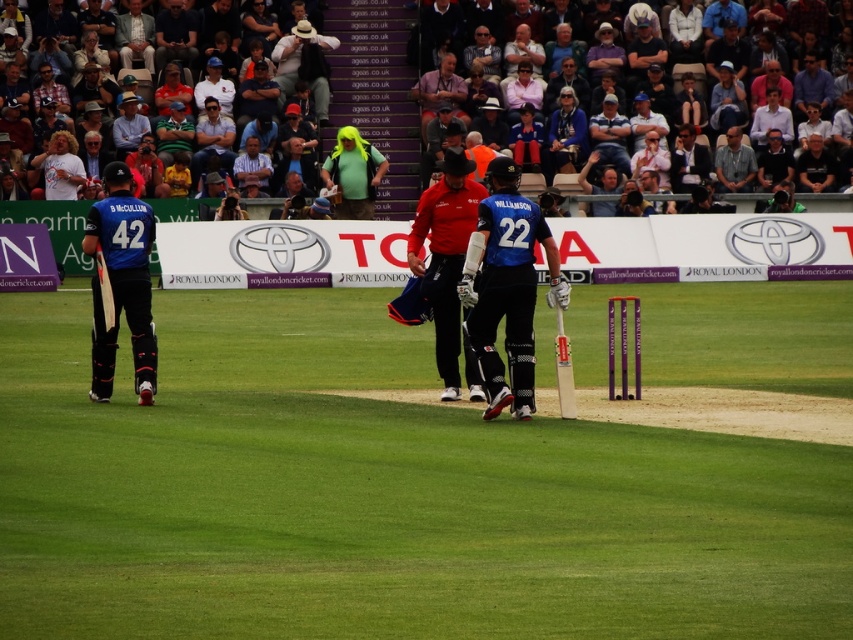
Between red matte bat at center and light brown leather jacket at upper center, which one has less height?

light brown leather jacket at upper center is shorter.

Which is in front, point (463, 244) or point (474, 61)?

Point (463, 244)

At what (x,y) coordinates should I click in order to perform the action: click on red matte bat at center. Please return your answer as a coordinate pair (x, y). The width and height of the screenshot is (853, 640). Looking at the image, I should click on (445, 253).

From the picture: Does light blue shirt at upper center have a greater width compared to gray fabric jacket at upper right?

Incorrect, light blue shirt at upper center's width does not surpass gray fabric jacket at upper right's.

Is light blue shirt at upper center thinner than gray fabric jacket at upper right?

Yes, light blue shirt at upper center is thinner than gray fabric jacket at upper right.

Locate an element on the screen. Image resolution: width=853 pixels, height=640 pixels. light blue shirt at upper center is located at coordinates (610, 134).

Does red matte bat at center appear on the left side of gray fabric jacket at upper right?

Correct, you'll find red matte bat at center to the left of gray fabric jacket at upper right.

Is red matte bat at center in front of gray fabric jacket at upper right?

Yes.

Is point (430, 228) less distant than point (743, 148)?

Yes, it is.

The width and height of the screenshot is (853, 640). In order to click on red matte bat at center in this screenshot , I will do `click(445, 253)`.